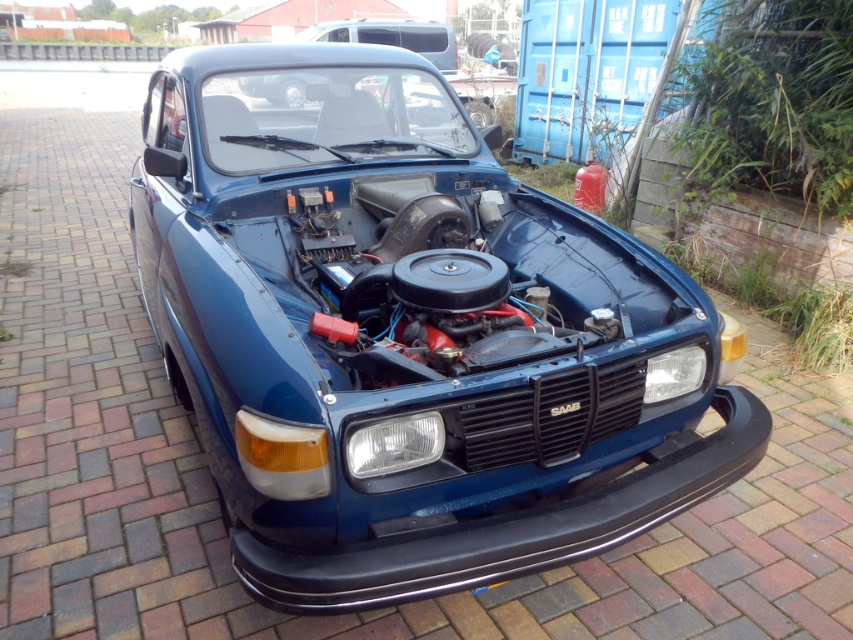
You are standing in a garage and see the glossy blue car at center. If you want to walk directly to the car from the entrance, which is located at the back wall, which direction should you head?

The glossy blue car at center is located at point coordinates that are not provided in the scene description, so I cannot determine the exact direction to walk. Please provide more information about the car or the garage layout.

You are an auto mechanic working in a garage. You need to access the engine of the glossy blue car at center. Given that the matte blue car at center is blocking the front, can you easily reach the engine compartment?

The glossy blue car at center is located below the matte blue car at center, so the matte blue car is blocking the front access to the engine. Therefore, you cannot easily reach the engine compartment of the glossy blue car at center.

Consider the image. You are a mechanic working in a garage. You need to move a 1.5 meter long tool cart between the glossy blue car at center and the matte blue car at center. Can the tool cart fit through the space between them?

The glossy blue car at center and matte blue car at center are 1.55 meters apart from each other. Since the tool cart is 1.5 meters long, it can fit through the space between them as the distance is slightly larger than the cart.